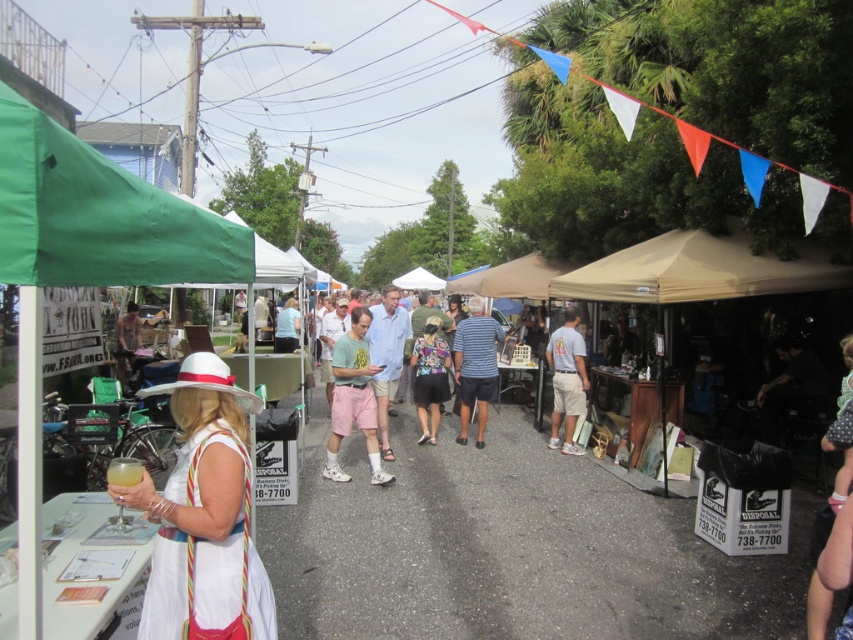
You are a customer at the outdoor market and see two shirts displayed at the center of the stall. The striped cotton shirt at center and the light blue shirt at center. Which shirt is narrower?

The striped cotton shirt at center is narrower than the light blue shirt at center.